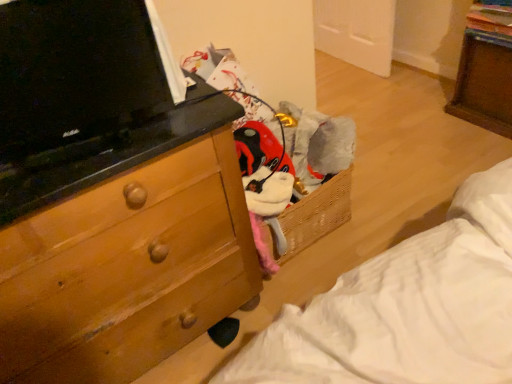
Question: Looking at their shapes, would you say black glossy tv at upper left is wider or thinner than wooden chest of drawers at left?

Choices:
 (A) wide
 (B) thin

Answer: (B)

Question: Based on their sizes in the image, would you say black glossy tv at upper left is bigger or smaller than wooden chest of drawers at left?

Choices:
 (A) small
 (B) big

Answer: (A)

Question: Does point (78, 109) appear closer or farther from the camera than point (202, 225)?

Choices:
 (A) farther
 (B) closer

Answer: (B)

Question: Considering the relative positions of wooden chest of drawers at left and black glossy tv at upper left in the image provided, is wooden chest of drawers at left to the left or to the right of black glossy tv at upper left?

Choices:
 (A) right
 (B) left

Answer: (B)

Question: From the image's perspective, relative to black glossy tv at upper left, is wooden chest of drawers at left above or below?

Choices:
 (A) above
 (B) below

Answer: (B)

Question: In the image, is wooden chest of drawers at left positioned in front of or behind black glossy tv at upper left?

Choices:
 (A) front
 (B) behind

Answer: (A)

Question: Looking at the image, does wooden chest of drawers at left seem bigger or smaller compared to black glossy tv at upper left?

Choices:
 (A) big
 (B) small

Answer: (A)